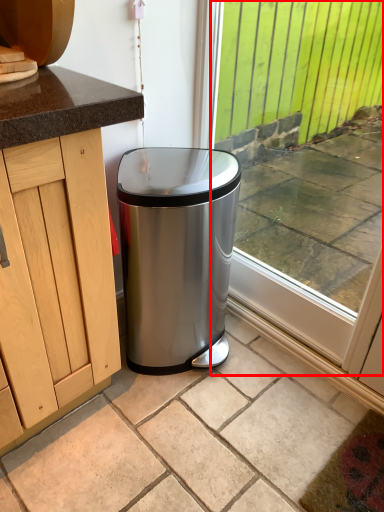
Question: From the image's perspective, considering the relative positions of window (annotated by the red box) and granite in the image provided, where is window (annotated by the red box) located with respect to the staircase?

Choices:
 (A) below
 (B) above

Answer: (B)